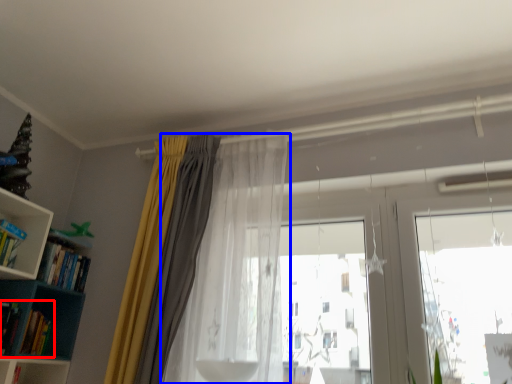
Question: Which object is further to the camera taking this photo, book (highlighted by a red box) or curtain (highlighted by a blue box)?

Choices:
 (A) book
 (B) curtain

Answer: (A)